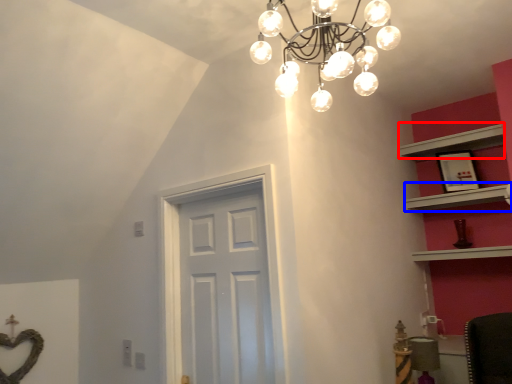
Question: Which point is closer to the camera, shelf (highlighted by a red box) or shelf (highlighted by a blue box)?

Choices:
 (A) shelf
 (B) shelf

Answer: (B)